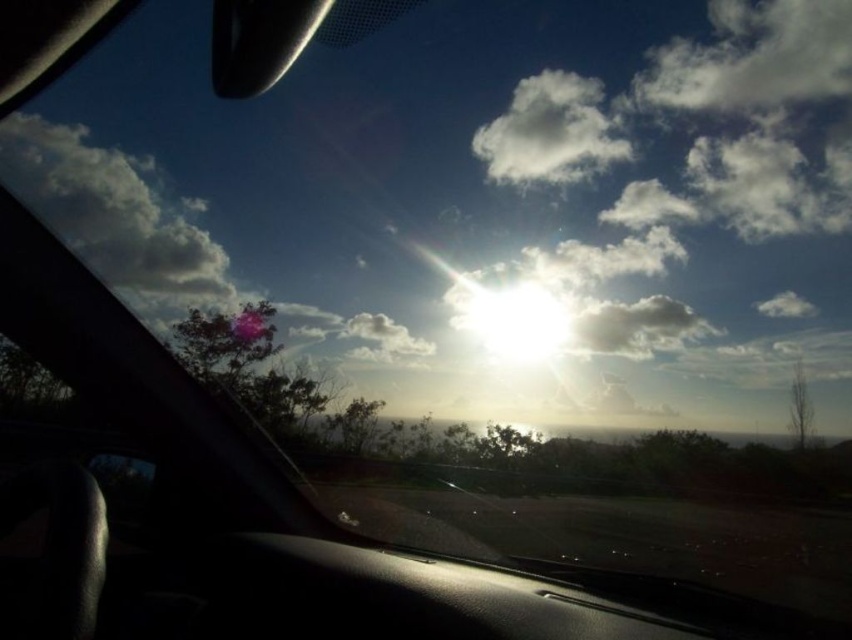
The height and width of the screenshot is (640, 852). What are the coordinates of `white fluffy cloud at upper left` in the screenshot? It's located at (110, 211).

Where is `white fluffy cloud at upper left`? white fluffy cloud at upper left is located at coordinates (110, 211).

Who is positioned more to the left, white fluffy cloud at upper right or white fluffy cloud at upper center?

From the viewer's perspective, white fluffy cloud at upper center appears more on the left side.

Does white fluffy cloud at upper right have a larger size compared to white fluffy cloud at upper center?

Indeed, white fluffy cloud at upper right has a larger size compared to white fluffy cloud at upper center.

Which is behind, point (734, 44) or point (513, 160)?

The point (734, 44) is behind.

This screenshot has width=852, height=640. I want to click on white fluffy cloud at upper right, so click(x=753, y=58).

Does white fluffy cloud at upper left have a greater width compared to white fluffy cloud at upper center?

In fact, white fluffy cloud at upper left might be narrower than white fluffy cloud at upper center.

Does white fluffy cloud at upper left have a lesser height compared to white fluffy cloud at upper center?

No, white fluffy cloud at upper left is not shorter than white fluffy cloud at upper center.

What do you see at coordinates (110, 211) in the screenshot? I see `white fluffy cloud at upper left` at bounding box center [110, 211].

Where is `white fluffy cloud at upper left`? white fluffy cloud at upper left is located at coordinates (110, 211).